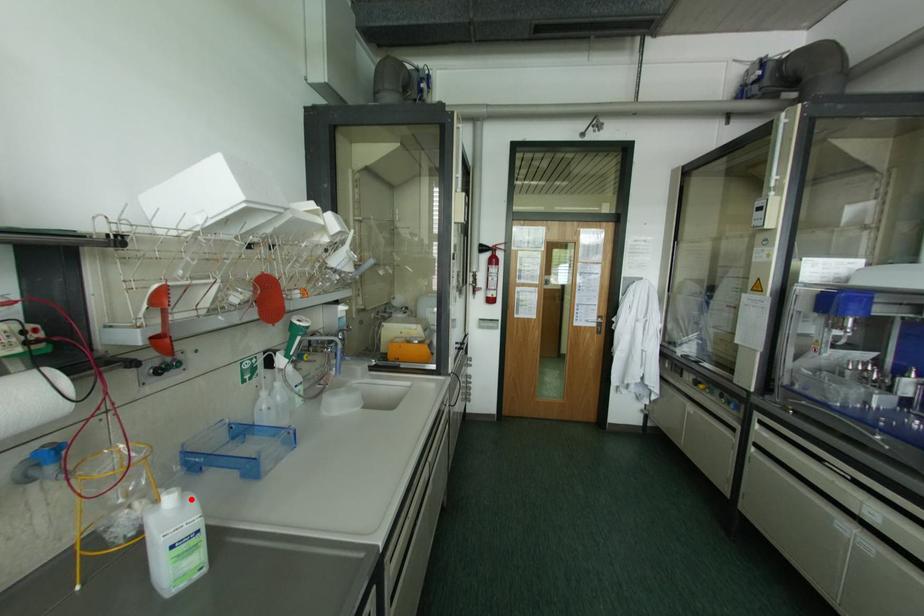
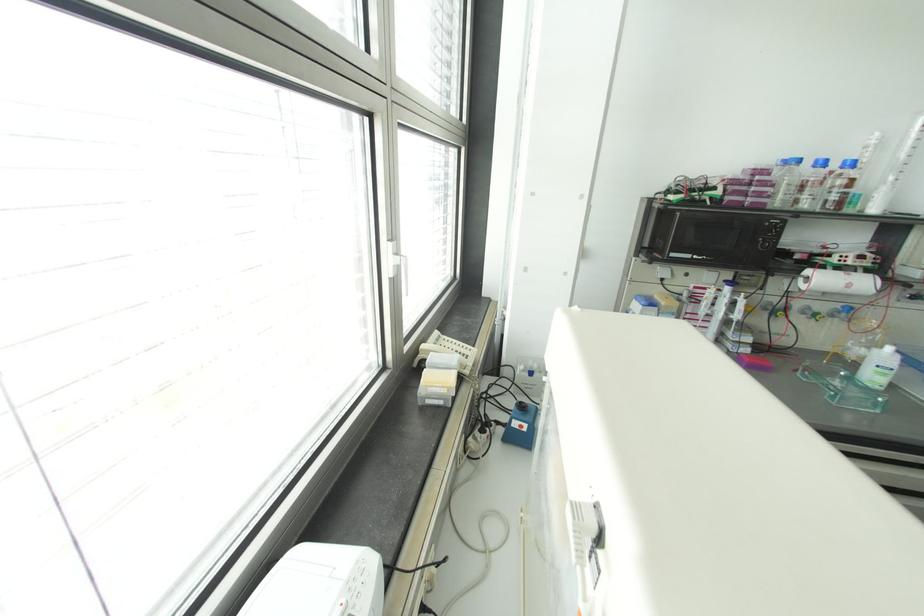
Question: I am providing you with two images of the same scene from different viewpoints. A red point is shown in image1. For the corresponding object point in image2, is it positioned nearer or farther from the camera?

Choices:
 (A) Nearer
 (B) Farther

Answer: (A)